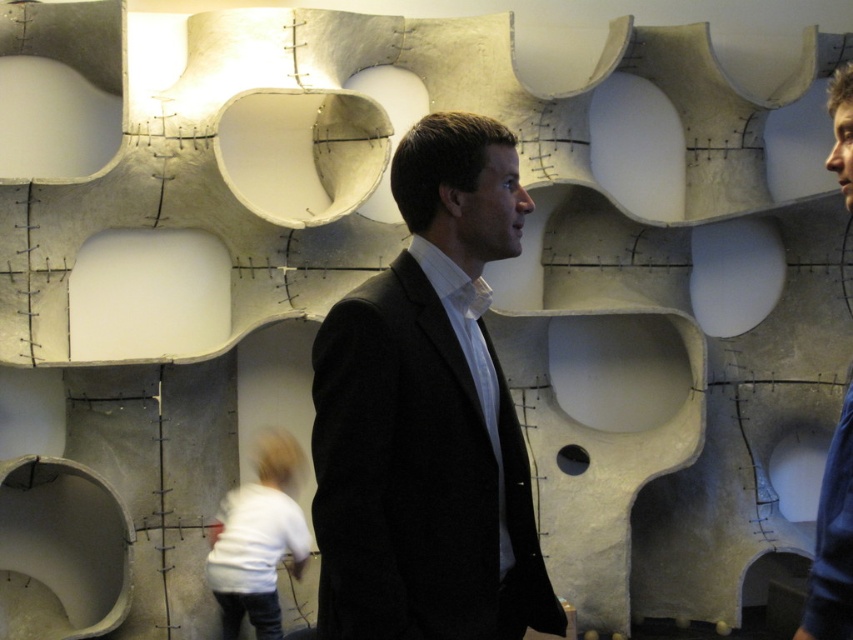
Does black matte suit at center appear on the right side of dark blue sweater at right?

No, black matte suit at center is not to the right of dark blue sweater at right.

Where is `black matte suit at center`? black matte suit at center is located at coordinates (428, 416).